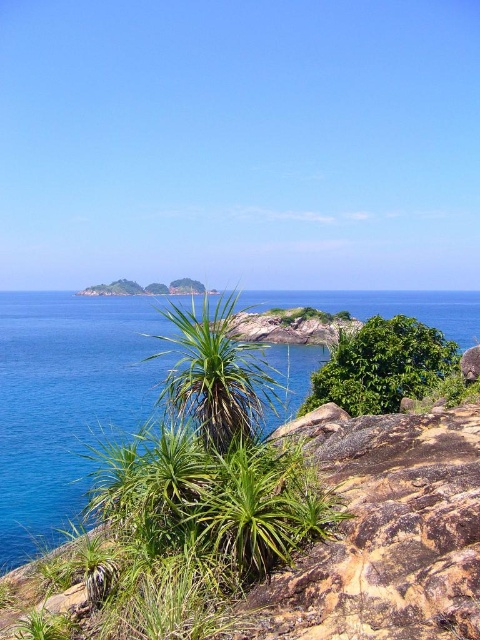
Question: Does blue clear water at center appear on the right side of green leafy bush at center?

Choices:
 (A) yes
 (B) no

Answer: (B)

Question: Which object is farther from the camera taking this photo?

Choices:
 (A) green leafy plant at center
 (B) green leafy bush at center

Answer: (B)

Question: Is green leafy plant at center positioned in front of green leafy bush at center?

Choices:
 (A) no
 (B) yes

Answer: (B)

Question: Which object is the closest to the green leafy bush at center?

Choices:
 (A) blue clear water at center
 (B) green leafy plant at center

Answer: (B)

Question: Is green leafy plant at center further to camera compared to green leafy bush at center?

Choices:
 (A) yes
 (B) no

Answer: (B)

Question: Estimate the real-world distances between objects in this image. Which object is farther from the blue clear water at center?

Choices:
 (A) green leafy plant at center
 (B) green leafy bush at center

Answer: (B)